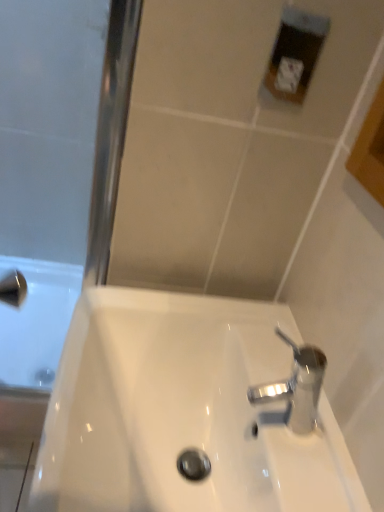
Question: From the image's perspective, does white glossy sink at center appear lower than polished chrome tap at lower right?

Choices:
 (A) yes
 (B) no

Answer: (A)

Question: Is white glossy sink at center completely or partially outside of polished chrome tap at lower right?

Choices:
 (A) yes
 (B) no

Answer: (A)

Question: Considering the relative sizes of white glossy sink at center and polished chrome tap at lower right in the image provided, is white glossy sink at center smaller than polished chrome tap at lower right?

Choices:
 (A) no
 (B) yes

Answer: (A)

Question: Is white glossy sink at center oriented away from polished chrome tap at lower right?

Choices:
 (A) no
 (B) yes

Answer: (A)

Question: From a real-world perspective, is white glossy sink at center located higher than polished chrome tap at lower right?

Choices:
 (A) yes
 (B) no

Answer: (B)

Question: Considering the relative sizes of white glossy sink at center and polished chrome tap at lower right in the image provided, is white glossy sink at center bigger than polished chrome tap at lower right?

Choices:
 (A) no
 (B) yes

Answer: (B)

Question: Does polished chrome tap at lower right have a smaller size compared to white glossy sink at center?

Choices:
 (A) yes
 (B) no

Answer: (A)

Question: Does polished chrome tap at lower right have a lesser width compared to white glossy sink at center?

Choices:
 (A) yes
 (B) no

Answer: (A)

Question: Considering the relative sizes of polished chrome tap at lower right and white glossy sink at center in the image provided, is polished chrome tap at lower right taller than white glossy sink at center?

Choices:
 (A) no
 (B) yes

Answer: (A)

Question: Is polished chrome tap at lower right positioned before white glossy sink at center?

Choices:
 (A) yes
 (B) no

Answer: (B)

Question: Considering the relative sizes of polished chrome tap at lower right and white glossy sink at center in the image provided, is polished chrome tap at lower right bigger than white glossy sink at center?

Choices:
 (A) yes
 (B) no

Answer: (B)

Question: Is the position of polished chrome tap at lower right more distant than that of white glossy sink at center?

Choices:
 (A) no
 (B) yes

Answer: (B)

Question: Based on their positions, is white glossy sink at center located to the left or right of polished chrome tap at lower right?

Choices:
 (A) left
 (B) right

Answer: (A)